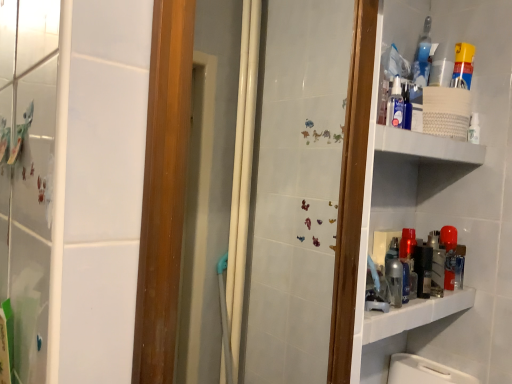
Question: Based on their positions, is white textured shelf at upper right located to the left or right of blue glass bottle at upper right?

Choices:
 (A) left
 (B) right

Answer: (A)

Question: Based on their sizes in the image, would you say white textured shelf at upper right is bigger or smaller than blue glass bottle at upper right?

Choices:
 (A) small
 (B) big

Answer: (B)

Question: Based on their relative distances, which object is nearer to the white textured shelf at upper right?

Choices:
 (A) yellow plastic spray can at upper right
 (B) blue glass bottle at upper right

Answer: (A)

Question: Estimate the real-world distances between objects in this image. Which object is farther from the white textured shelf at upper right?

Choices:
 (A) blue glass bottle at upper right
 (B) yellow plastic spray can at upper right

Answer: (A)